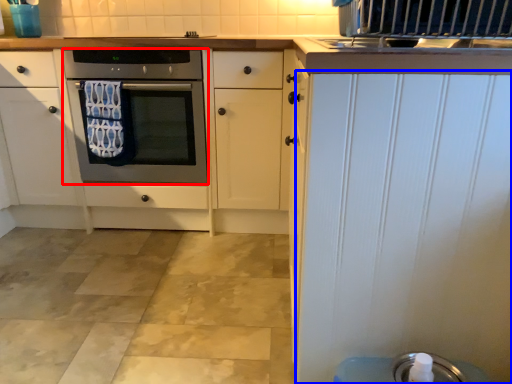
Question: Among these objects, which one is farthest to the camera, oven (highlighted by a red box) or door (highlighted by a blue box)?

Choices:
 (A) oven
 (B) door

Answer: (A)